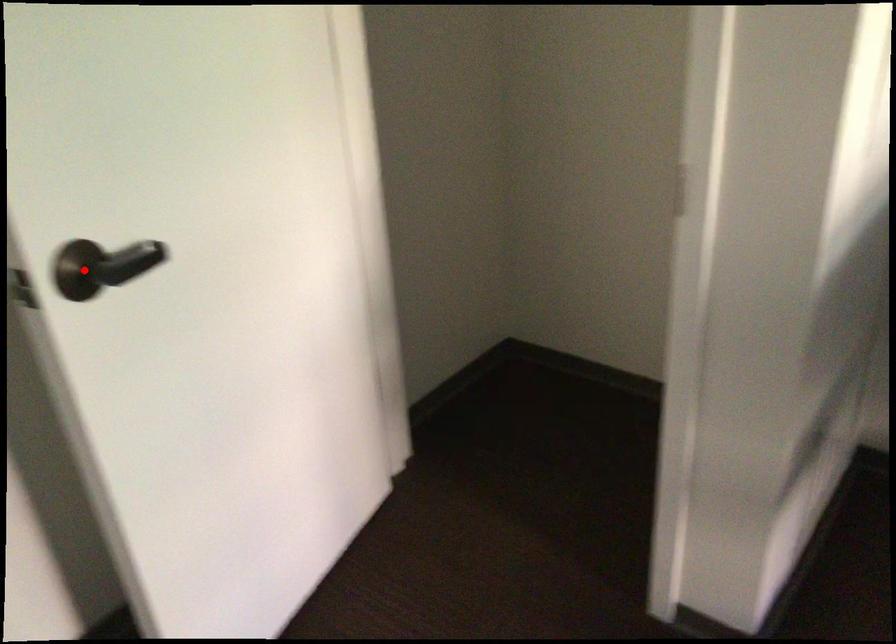
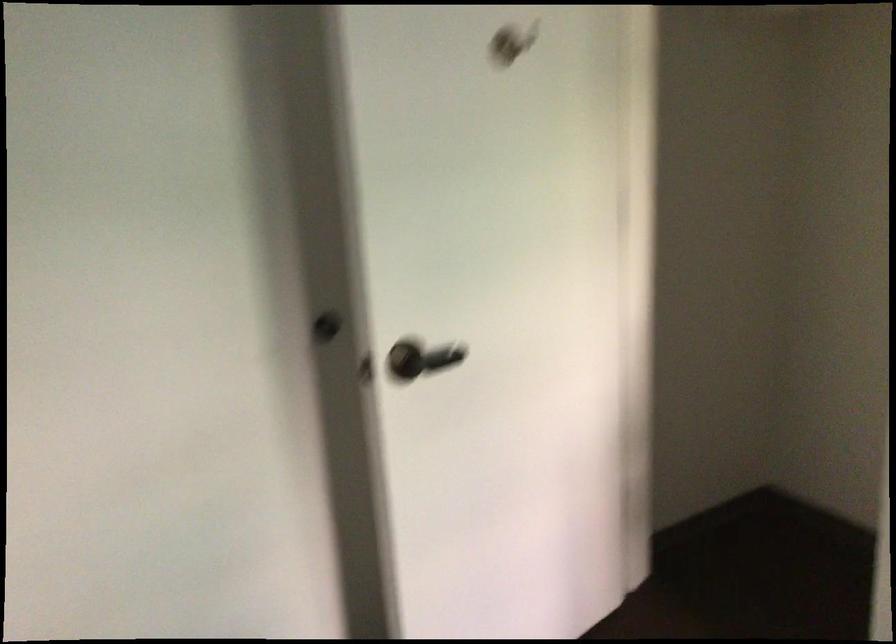
Find the pixel in the second image that matches the highlighted location in the first image.

(407, 359)